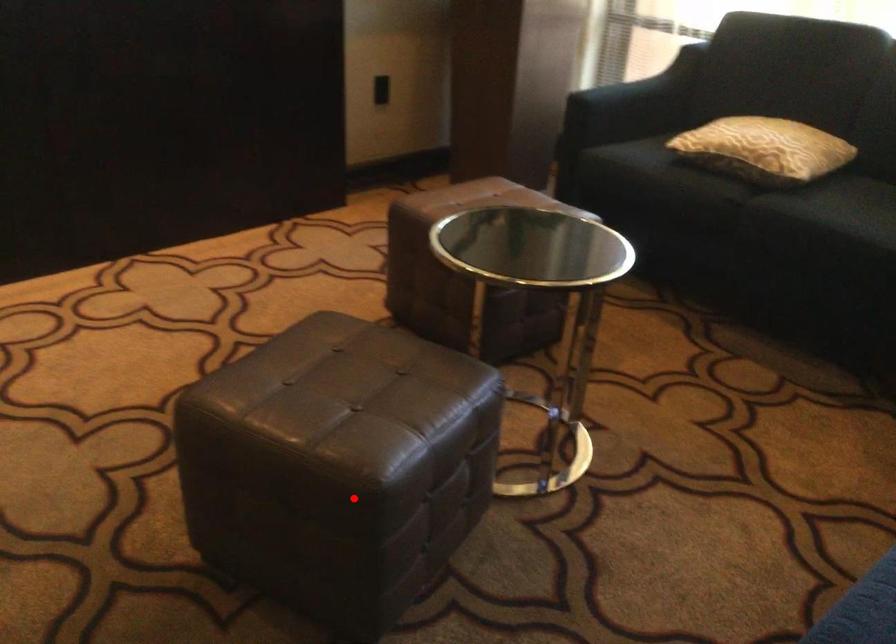
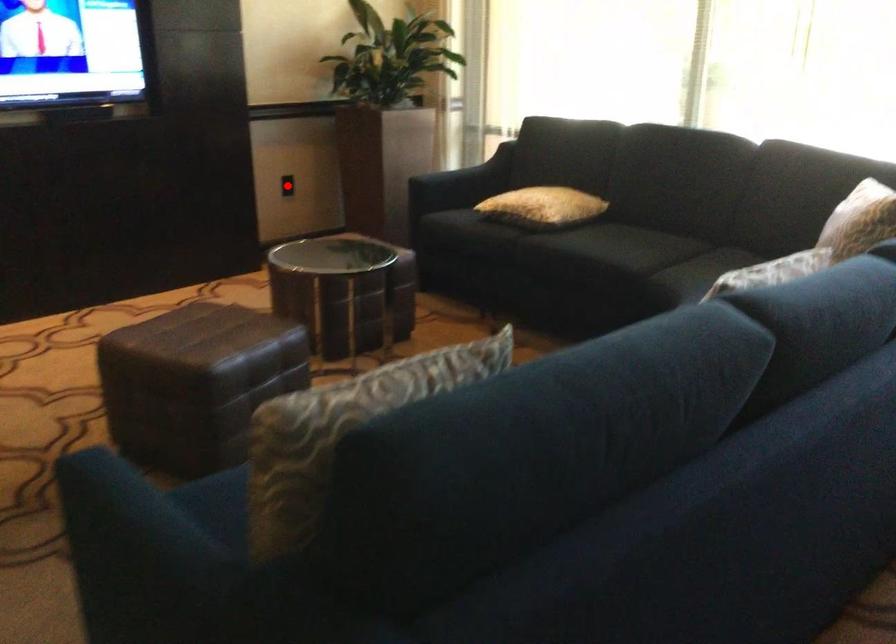
I am providing you with two images of the same scene from different viewpoints. A red point is marked on the first image and another point is marked on the second image. Do the highlighted points in image1 and image2 indicate the same real-world spot?

No